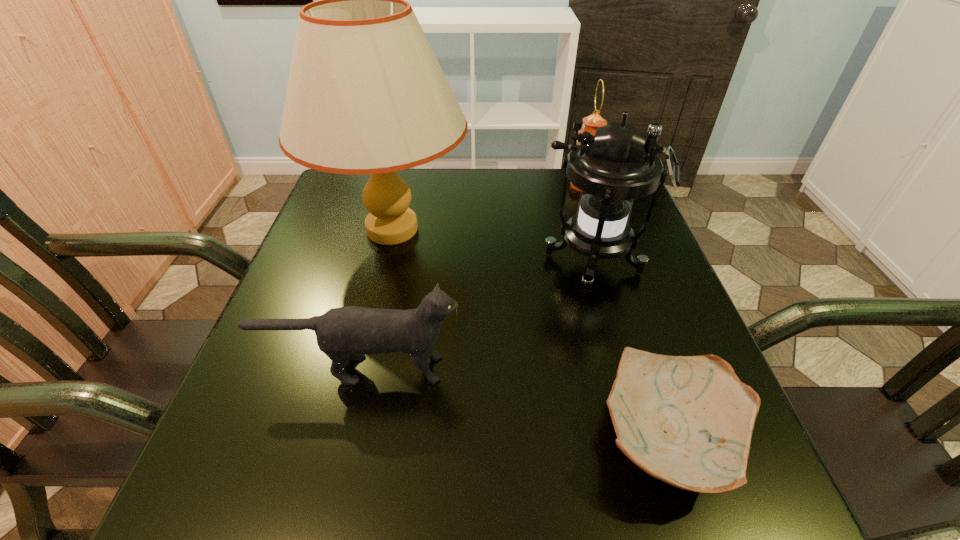
Identify the location of object that is positioned at the near right corner. (686, 420).

Locate an element on the screen. vacant space at the far edge of the desktop is located at coordinates (426, 187).

Image resolution: width=960 pixels, height=540 pixels. I want to click on free space at the near edge of the desktop, so click(x=605, y=487).

Where is `vacant space at the left edge of the desktop`? vacant space at the left edge of the desktop is located at coordinates (343, 296).

Where is `vacant space at the right edge`? The image size is (960, 540). vacant space at the right edge is located at coordinates (608, 269).

Where is `free location at the far left corner of the desktop`? The height and width of the screenshot is (540, 960). free location at the far left corner of the desktop is located at coordinates (330, 197).

This screenshot has height=540, width=960. I want to click on vacant area that lies between the fourth shortest object and the second shortest object, so click(x=478, y=316).

Where is `vacant space in between the second shortest object and the tallest object`? Image resolution: width=960 pixels, height=540 pixels. vacant space in between the second shortest object and the tallest object is located at coordinates (377, 299).

Locate an element on the screen. Image resolution: width=960 pixels, height=540 pixels. vacant point located between the second shortest object and the pottery is located at coordinates (516, 404).

Find the location of a particular element. Image resolution: width=960 pixels, height=540 pixels. empty space that is in between the shortest object and the second shortest object is located at coordinates (516, 404).